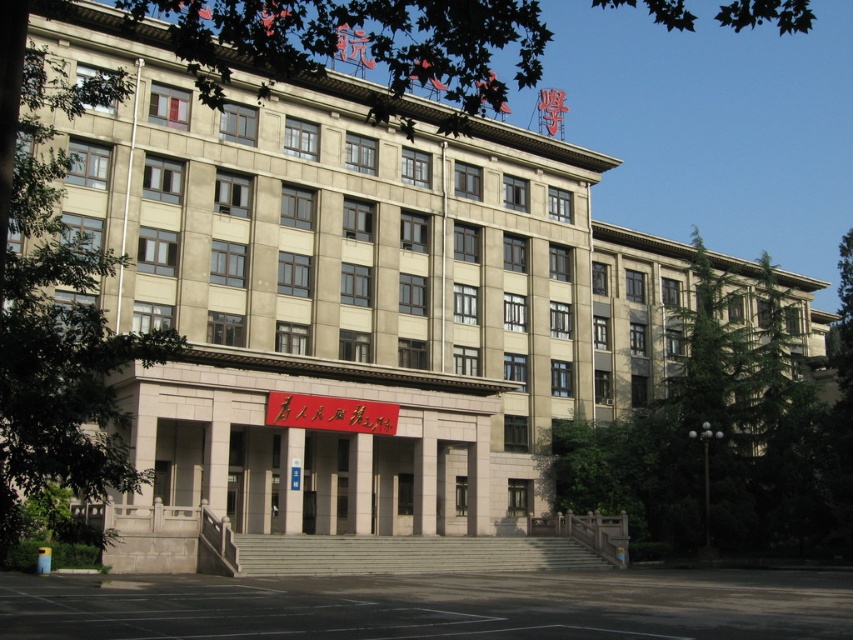
Is point (589, 502) behind point (397, 102)?

Yes, it is behind point (397, 102).

Is point (572, 435) behind point (248, 19)?

That is True.

Find the location of a particular element. This screenshot has width=853, height=640. green leafy tree at right is located at coordinates (722, 436).

Does green leafy tree at left appear under green leafy tree at upper center?

Yes.

Between green leafy tree at left and green leafy tree at upper center, which one is positioned lower?

Positioned lower is green leafy tree at left.

Is point (3, 170) less distant than point (648, 0)?

Yes.

Identify the location of green leafy tree at left. Image resolution: width=853 pixels, height=640 pixels. (56, 308).

Does green leafy tree at right have a lesser height compared to green leafy tree at left?

No, green leafy tree at right is not shorter than green leafy tree at left.

Between green leafy tree at right and green leafy tree at left, which one appears on the left side from the viewer's perspective?

Positioned to the left is green leafy tree at left.

Is point (570, 444) more distant than point (9, 486)?

Yes, point (570, 444) is farther from viewer.

You are a GUI agent. You are given a task and a screenshot of the screen. Output one action in this format:
    pyautogui.click(x=<x>, y=<y>)
    Task: Click on the green leafy tree at right
    This screenshot has height=640, width=853.
    Given the screenshot: What is the action you would take?
    pyautogui.click(x=722, y=436)